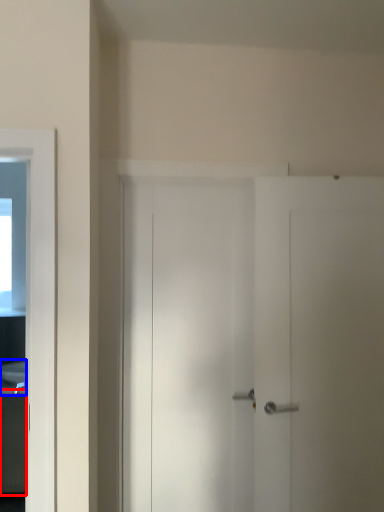
Question: Which object appears farthest to the camera in this image, cabinetry (highlighted by a red box) or sink (highlighted by a blue box)?

Choices:
 (A) cabinetry
 (B) sink

Answer: (B)